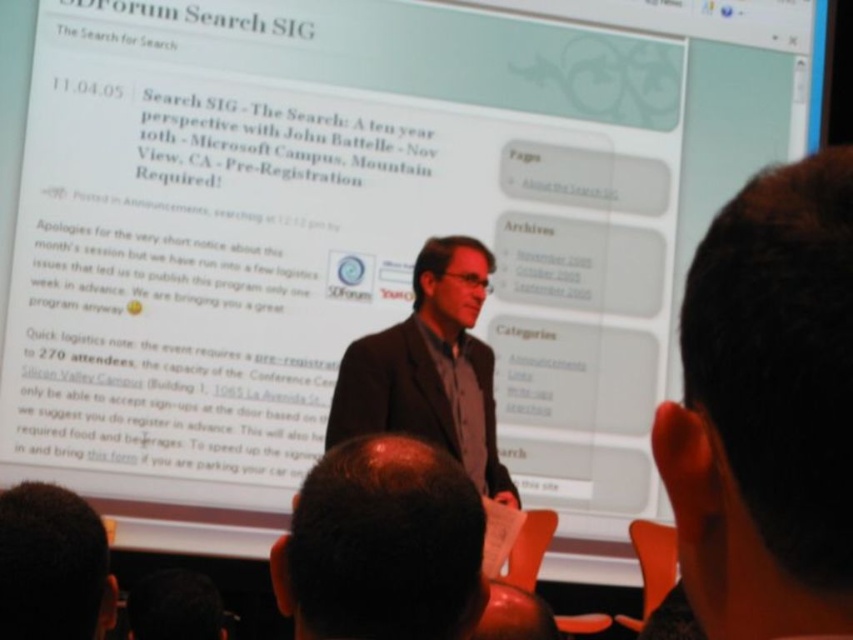
Based on the photo, is the position of brown hair at center less distant than that of dark brown hair at lower left?

Yes, it is.

Is brown hair at center to the right of dark brown hair at lower left from the viewer's perspective?

Correct, you'll find brown hair at center to the right of dark brown hair at lower left.

At what (x,y) coordinates should I click in order to perform the action: click on brown hair at center. Please return your answer as a coordinate pair (x, y). Image resolution: width=853 pixels, height=640 pixels. Looking at the image, I should click on (381, 545).

Measure the distance between dark brown hair at upper right and dark brown hair at center.

dark brown hair at upper right is 1.22 meters from dark brown hair at center.

Is dark brown hair at upper right further to camera compared to dark brown hair at center?

No, dark brown hair at upper right is in front of dark brown hair at center.

Describe the element at coordinates (767, 410) in the screenshot. I see `dark brown hair at upper right` at that location.

You are a GUI agent. You are given a task and a screenshot of the screen. Output one action in this format:
    pyautogui.click(x=<x>, y=<y>)
    Task: Click on the dark brown hair at upper right
    
    Given the screenshot: What is the action you would take?
    pyautogui.click(x=767, y=410)

Who is lower down, dark brown hair at upper right or brown hair at center?

brown hair at center is lower down.

In the scene shown: Is dark brown hair at upper right thinner than brown hair at center?

Correct, dark brown hair at upper right's width is less than brown hair at center's.

Describe the element at coordinates (767, 410) in the screenshot. I see `dark brown hair at upper right` at that location.

I want to click on dark brown hair at upper right, so click(767, 410).